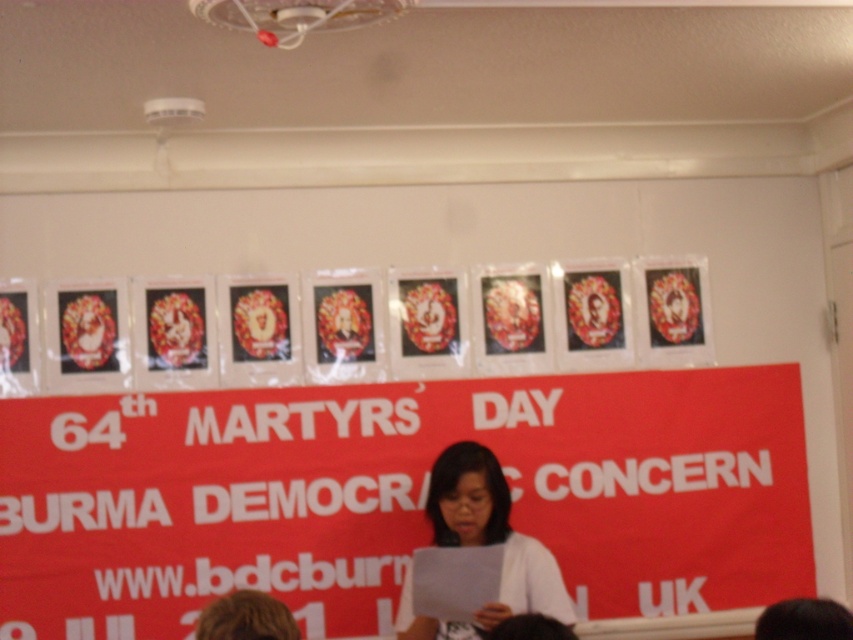
Question: Is red matte poster at center thinner than white paper at center?

Choices:
 (A) no
 (B) yes

Answer: (A)

Question: Which point appears farthest from the camera in this image?

Choices:
 (A) (492, 474)
 (B) (97, 412)

Answer: (B)

Question: Observing the image, what is the correct spatial positioning of red matte poster at center in reference to white paper at center?

Choices:
 (A) below
 (B) above

Answer: (B)

Question: Which object is farther from the camera taking this photo?

Choices:
 (A) red matte poster at center
 (B) white paper at center

Answer: (A)

Question: Is the position of red matte poster at center more distant than that of white paper at center?

Choices:
 (A) no
 (B) yes

Answer: (B)

Question: Which of the following is the farthest from the observer?

Choices:
 (A) white paper at center
 (B) red matte poster at center

Answer: (B)